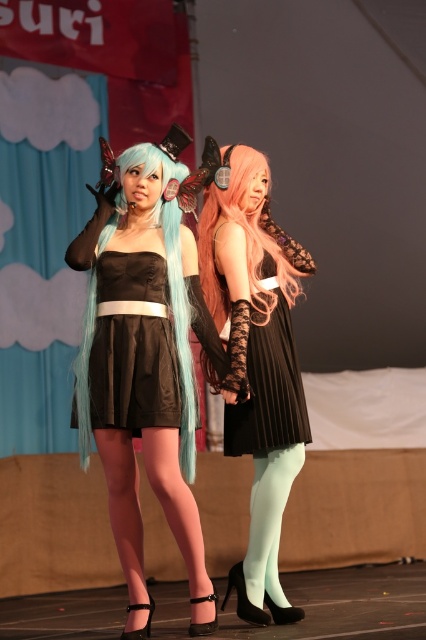
Question: Can you confirm if matte black dress at center is positioned to the right of black satin dress at center?

Choices:
 (A) yes
 (B) no

Answer: (A)

Question: Which object is positioned closest to the satin black dress at center?

Choices:
 (A) black pleated dress at center
 (B) matte black dress at center
 (C) black satin dress at center

Answer: (A)

Question: Is matte black dress at center closer to camera compared to black satin dress at center?

Choices:
 (A) yes
 (B) no

Answer: (A)

Question: Considering the real-world distances, which object is farthest from the black pleated dress at center?

Choices:
 (A) satin black dress at center
 (B) light blue silky tights at lower center

Answer: (B)

Question: Which point is farther to the camera?

Choices:
 (A) (255, 604)
 (B) (169, 426)
 (C) (265, 259)

Answer: (C)

Question: Is black satin dress at center above light blue silky tights at lower center?

Choices:
 (A) yes
 (B) no

Answer: (A)